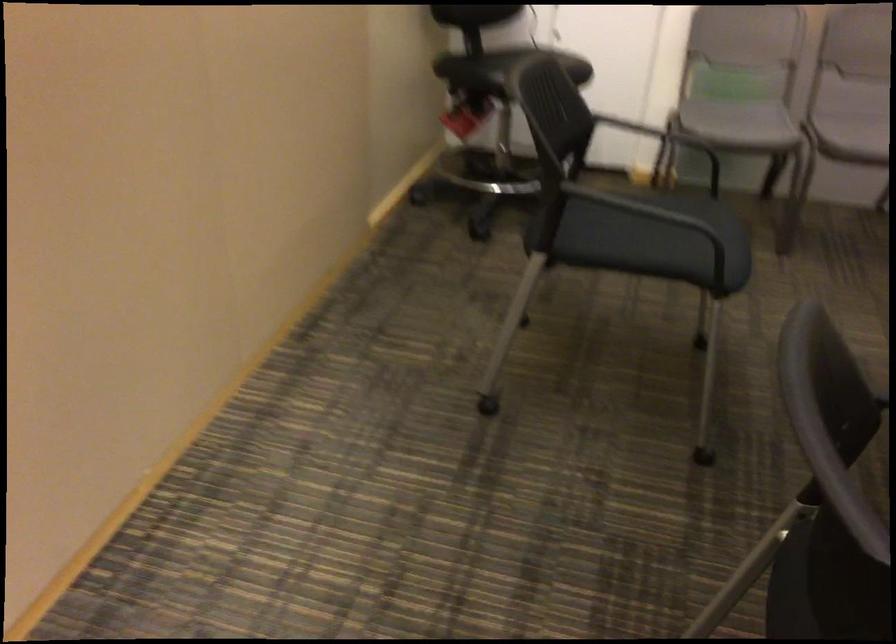
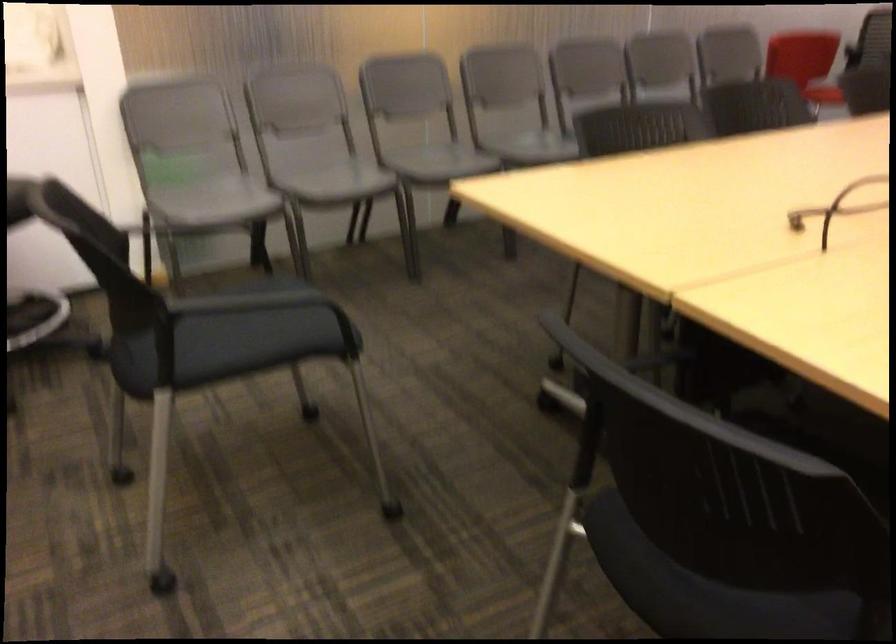
Question: The first image is from the beginning of the video and the second image is from the end. How did the camera likely rotate when shooting the video?

Choices:
 (A) Left
 (B) Right
 (C) Up
 (D) Down

Answer: (B)